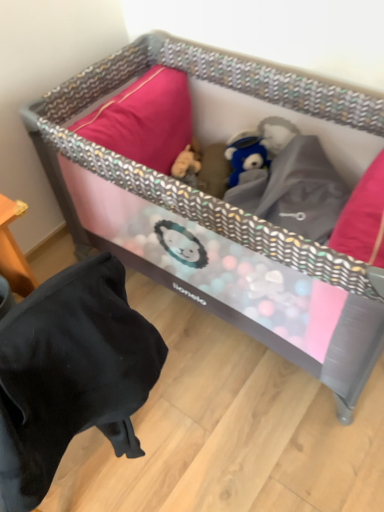
Question: In terms of height, does fuzzy brown stuffed animal at center look taller or shorter compared to pink fabric playpen at center?

Choices:
 (A) short
 (B) tall

Answer: (A)

Question: Based on their sizes in the image, would you say fuzzy brown stuffed animal at center is bigger or smaller than pink fabric playpen at center?

Choices:
 (A) small
 (B) big

Answer: (A)

Question: Estimate the real-world distances between objects in this image. Which object is closer to the pink fabric playpen at center?

Choices:
 (A) black fabric bean bag chair at lower left
 (B) fuzzy brown stuffed animal at center

Answer: (B)

Question: Based on their relative distances, which object is nearer to the fuzzy brown stuffed animal at center?

Choices:
 (A) black fabric bean bag chair at lower left
 (B) pink fabric playpen at center

Answer: (B)